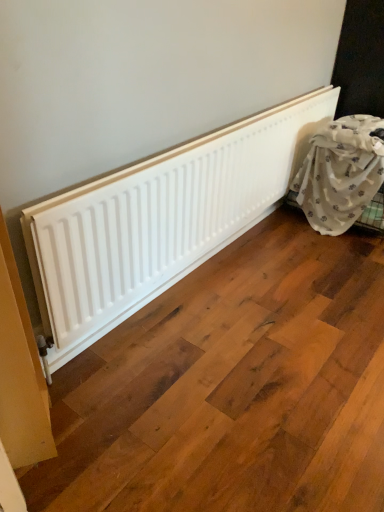
Question: Should I look upward or downward to see white fabric at right?

Choices:
 (A) up
 (B) down

Answer: (A)

Question: From a real-world perspective, is white matte radiator at center physically above white fabric at right?

Choices:
 (A) yes
 (B) no

Answer: (A)

Question: From the image's perspective, would you say white matte radiator at center is positioned over white fabric at right?

Choices:
 (A) yes
 (B) no

Answer: (B)

Question: Does white matte radiator at center have a lesser height compared to white fabric at right?

Choices:
 (A) yes
 (B) no

Answer: (A)

Question: Is white matte radiator at center next to white fabric at right and touching it?

Choices:
 (A) no
 (B) yes

Answer: (A)

Question: Does white matte radiator at center turn towards white fabric at right?

Choices:
 (A) yes
 (B) no

Answer: (A)

Question: Does white matte radiator at center have a greater width compared to white fabric at right?

Choices:
 (A) no
 (B) yes

Answer: (A)

Question: Is white fabric at right thinner than white matte radiator at center?

Choices:
 (A) no
 (B) yes

Answer: (A)

Question: Is white fabric at right positioned far away from white matte radiator at center?

Choices:
 (A) yes
 (B) no

Answer: (B)

Question: Can you confirm if white fabric at right is shorter than white matte radiator at center?

Choices:
 (A) no
 (B) yes

Answer: (A)

Question: From a real-world perspective, is white fabric at right positioned over white matte radiator at center based on gravity?

Choices:
 (A) no
 (B) yes

Answer: (A)

Question: Is white fabric at right positioned beyond the bounds of white matte radiator at center?

Choices:
 (A) no
 (B) yes

Answer: (B)

Question: Can you confirm if white fabric at right is bigger than white matte radiator at center?

Choices:
 (A) no
 (B) yes

Answer: (B)

Question: Do you think white matte radiator at center is within white fabric at right, or outside of it?

Choices:
 (A) outside
 (B) inside

Answer: (A)